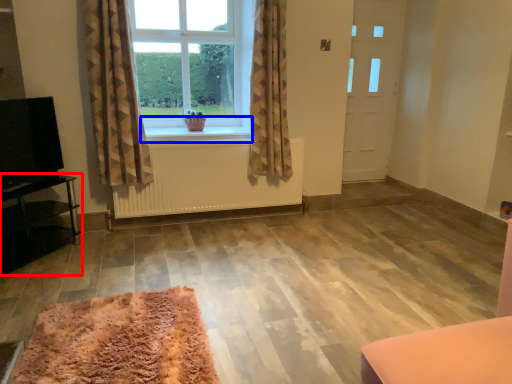
Question: Which object appears closest to the camera in this image, furniture (highlighted by a red box) or window sill (highlighted by a blue box)?

Choices:
 (A) furniture
 (B) window sill

Answer: (A)